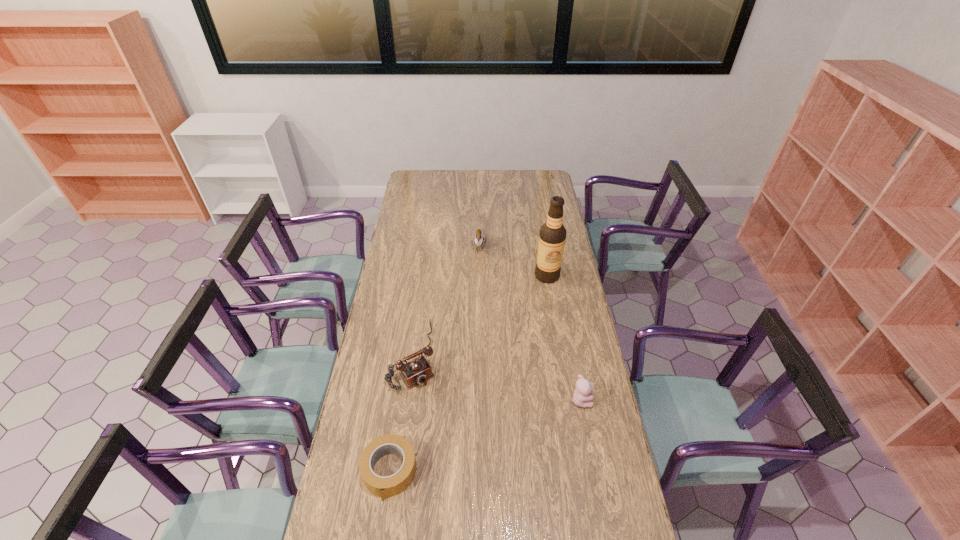
Where is `the nearest object`? The height and width of the screenshot is (540, 960). the nearest object is located at coordinates (392, 485).

Find the location of a particular element. The image size is (960, 540). duct tape is located at coordinates (392, 485).

I want to click on teddy bear, so click(x=581, y=397).

You are a GUI agent. You are given a task and a screenshot of the screen. Output one action in this format:
    pyautogui.click(x=<x>, y=<y>)
    Task: Click on the second farthest object
    This screenshot has height=540, width=960.
    Given the screenshot: What is the action you would take?
    pyautogui.click(x=552, y=235)

Identify the location of the tallest object. (552, 235).

Identify the location of telephone. (417, 371).

Locate an element on the screen. This screenshot has height=540, width=960. bird is located at coordinates (478, 239).

Image resolution: width=960 pixels, height=540 pixels. What are the coordinates of `the fourth shortest object` in the screenshot? It's located at pos(478,239).

The width and height of the screenshot is (960, 540). I want to click on vacant area located 0.070m at the edge of the duct tape, so click(381, 526).

You are a GUI agent. You are given a task and a screenshot of the screen. Output one action in this format:
    pyautogui.click(x=<x>, y=<y>)
    Task: Click on the free space located 0.210m on the label of the alcohol
    The height and width of the screenshot is (540, 960).
    Given the screenshot: What is the action you would take?
    pyautogui.click(x=535, y=315)